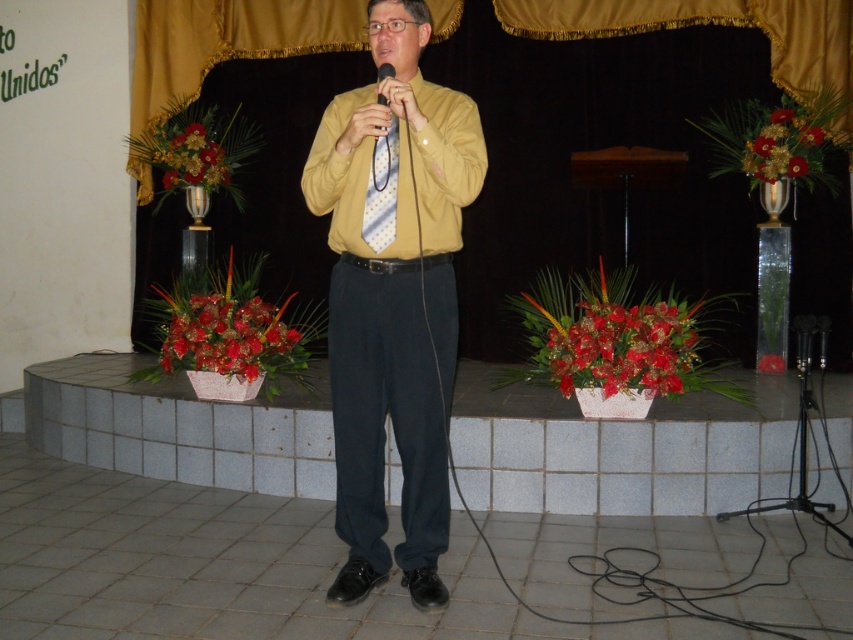
Can you confirm if shiny red flowers at center is positioned below white dotted tie at center?

Correct, shiny red flowers at center is located below white dotted tie at center.

Between point (579, 324) and point (392, 192), which one is positioned behind?

Point (579, 324)

Locate an element on the screen. Image resolution: width=853 pixels, height=640 pixels. shiny red flowers at center is located at coordinates (622, 348).

Which is more to the right, yellow smooth dress shirt at center or glossy ceramic flower at center?

Positioned to the right is yellow smooth dress shirt at center.

Is point (399, 234) positioned behind point (283, 305)?

That is False.

In order to click on yellow smooth dress shirt at center in this screenshot , I will do `click(361, 184)`.

Where is `yellow smooth dress shirt at center`? The height and width of the screenshot is (640, 853). yellow smooth dress shirt at center is located at coordinates (361, 184).

Which is below, shiny metallic vase at upper right or glossy floral arrangement at left?

shiny metallic vase at upper right

Measure the distance between shiny metallic vase at upper right and camera.

The distance of shiny metallic vase at upper right from camera is 4.85 meters.

Is point (759, 172) closer to camera compared to point (210, 134)?

Yes, it is in front of point (210, 134).

Where is `shiny metallic vase at upper right`? shiny metallic vase at upper right is located at coordinates (782, 145).